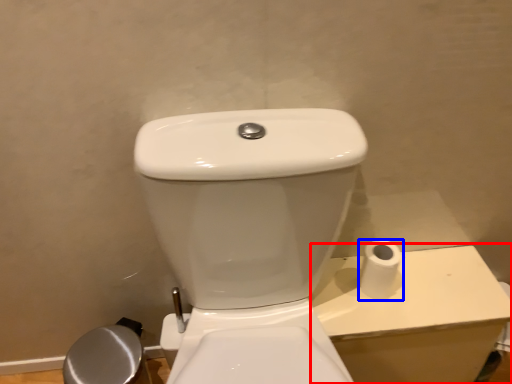
Question: Which object is further to the camera taking this photo, porcelain (highlighted by a red box) or toilet paper (highlighted by a blue box)?

Choices:
 (A) porcelain
 (B) toilet paper

Answer: (A)